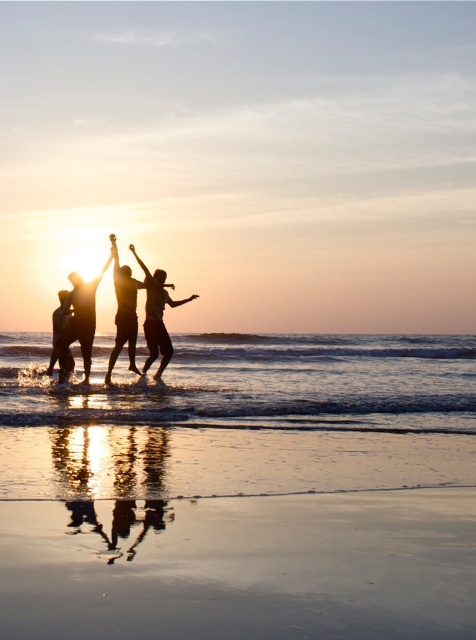
Question: Which of the following is the farthest from the observer?

Choices:
 (A) matte black person at center
 (B) silhouette figure at center

Answer: (B)

Question: Does clear water at lower center have a lesser width compared to matte black person at center?

Choices:
 (A) yes
 (B) no

Answer: (B)

Question: Which point is farther to the camera?

Choices:
 (A) (446, 400)
 (B) (59, 348)
 (C) (160, 288)
 (D) (126, 326)

Answer: (C)

Question: Is shiny sand beach at lower center positioned at the back of matte black person at center?

Choices:
 (A) no
 (B) yes

Answer: (A)

Question: Considering the relative positions of shiny sand beach at lower center and silhouette figure at lower left in the image provided, where is shiny sand beach at lower center located with respect to silhouette figure at lower left?

Choices:
 (A) above
 (B) below

Answer: (B)

Question: Which object is the farthest from the matte black person at center?

Choices:
 (A) clear water at lower center
 (B) shiny sand beach at lower center

Answer: (B)